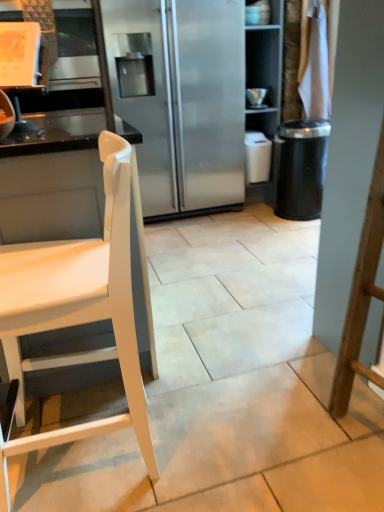
Where is `vacant area that is in front of black textured trash can at right`? Image resolution: width=384 pixels, height=512 pixels. vacant area that is in front of black textured trash can at right is located at coordinates (294, 232).